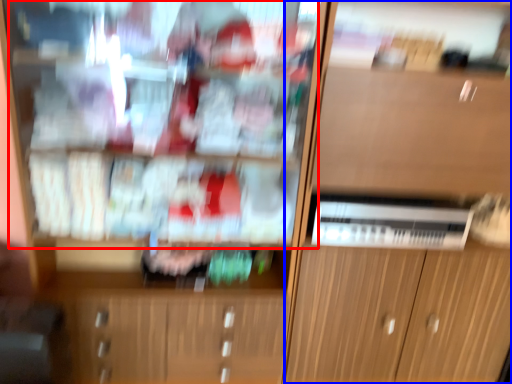
Question: Among these objects, which one is nearest to the camera, shelf (highlighted by a red box) or cabinetry (highlighted by a blue box)?

Choices:
 (A) shelf
 (B) cabinetry

Answer: (A)